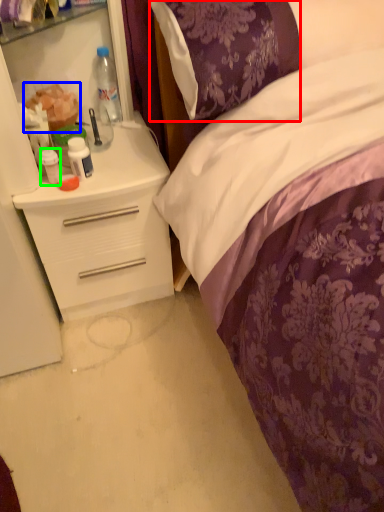
Question: Based on their relative distances, which object is nearer to pillow (highlighted by a red box)? Choose from food (highlighted by a blue box) and bottle (highlighted by a green box).

Choices:
 (A) food
 (B) bottle

Answer: (A)